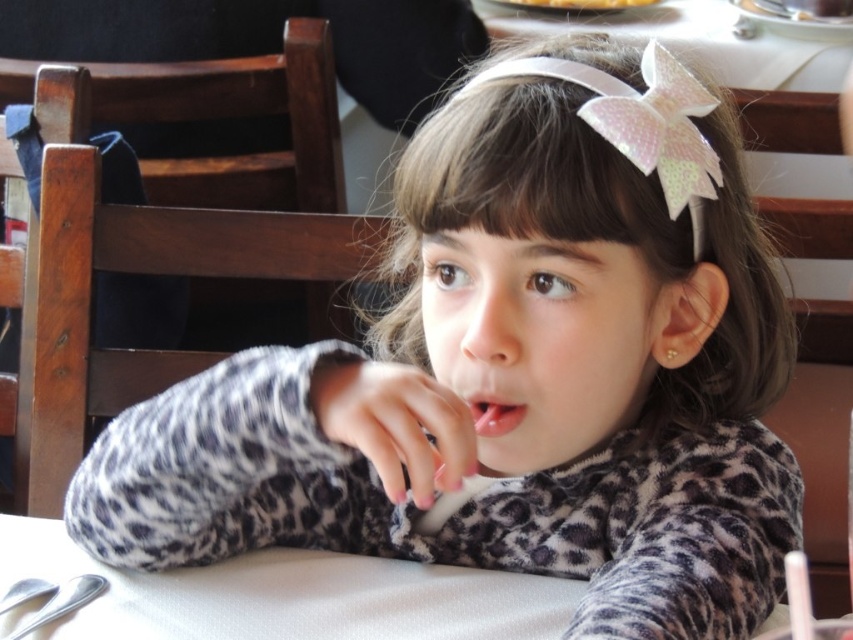
Who is shorter, white matte table at center or pink glossy lips at center?

pink glossy lips at center is shorter.

Does white matte table at center lie behind pink glossy lips at center?

Yes, it is behind pink glossy lips at center.

This screenshot has width=853, height=640. Find the location of `white matte table at center`. white matte table at center is located at coordinates (289, 595).

Locate an element on the screen. Image resolution: width=853 pixels, height=640 pixels. white matte table at center is located at coordinates (289, 595).